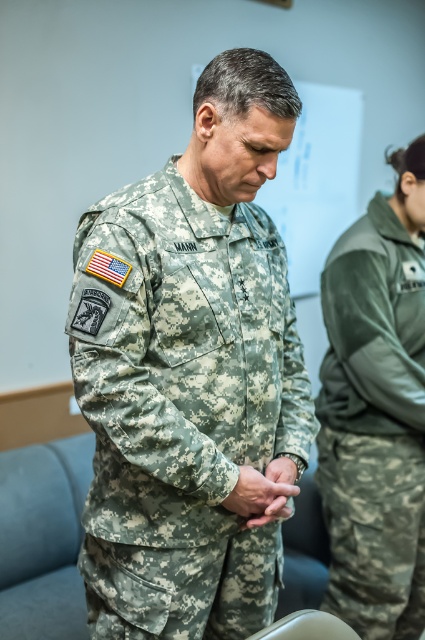
Does camouflage fabric uniform at center appear on the left side of camouflage fabric hand at center?

Correct, you'll find camouflage fabric uniform at center to the left of camouflage fabric hand at center.

Who is positioned more to the right, camouflage fabric uniform at center or camouflage fabric hand at center?

Positioned to the right is camouflage fabric hand at center.

Where is `camouflage fabric uniform at center`? The image size is (425, 640). camouflage fabric uniform at center is located at coordinates (181, 408).

Can you confirm if camouflage fabric uniform at center is thinner than green matte uniform at right?

No.

Locate an element on the screen. camouflage fabric uniform at center is located at coordinates (181, 408).

Find the location of a particular element. camouflage fabric uniform at center is located at coordinates (181, 408).

Does green matte uniform at right have a lesser width compared to camouflage fabric hand at center?

No.

You are a GUI agent. You are given a task and a screenshot of the screen. Output one action in this format:
    pyautogui.click(x=<x>, y=<y>)
    Task: Click on the green matte uniform at right
    
    Given the screenshot: What is the action you would take?
    pyautogui.click(x=374, y=426)